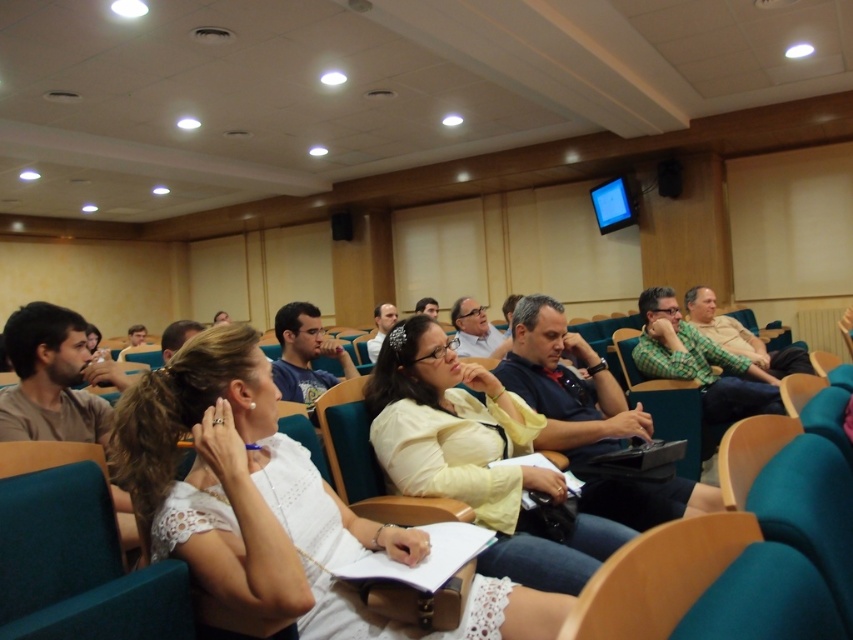
Between point (293, 524) and point (782, 372), which one is positioned behind?

The point (782, 372) is more distant.

From the picture: Can you confirm if white lace dress at center is positioned above green plaid shirt at right?

Actually, white lace dress at center is below green plaid shirt at right.

Does point (158, 390) come behind point (733, 330)?

No, it is in front of (733, 330).

Where is `white lace dress at center`? Image resolution: width=853 pixels, height=640 pixels. white lace dress at center is located at coordinates (245, 496).

Does matte white blouse at center have a lesser width compared to matte white shirt at center?

Incorrect, matte white blouse at center's width is not less than matte white shirt at center's.

What do you see at coordinates (474, 456) in the screenshot? I see `matte white blouse at center` at bounding box center [474, 456].

You are a GUI agent. You are given a task and a screenshot of the screen. Output one action in this format:
    pyautogui.click(x=<x>, y=<y>)
    Task: Click on the matte white blouse at center
    The height and width of the screenshot is (640, 853).
    Given the screenshot: What is the action you would take?
    pyautogui.click(x=474, y=456)

Does green plaid shirt at right have a lesser height compared to matte black laptop at center?

In fact, green plaid shirt at right may be taller than matte black laptop at center.

Between point (802, 368) and point (375, 360), which one is positioned in front?

Point (802, 368) is in front.

Is point (808, 362) positioned in front of point (386, 330)?

Yes, point (808, 362) is in front of point (386, 330).

Locate an element on the screen. The width and height of the screenshot is (853, 640). green plaid shirt at right is located at coordinates (740, 336).